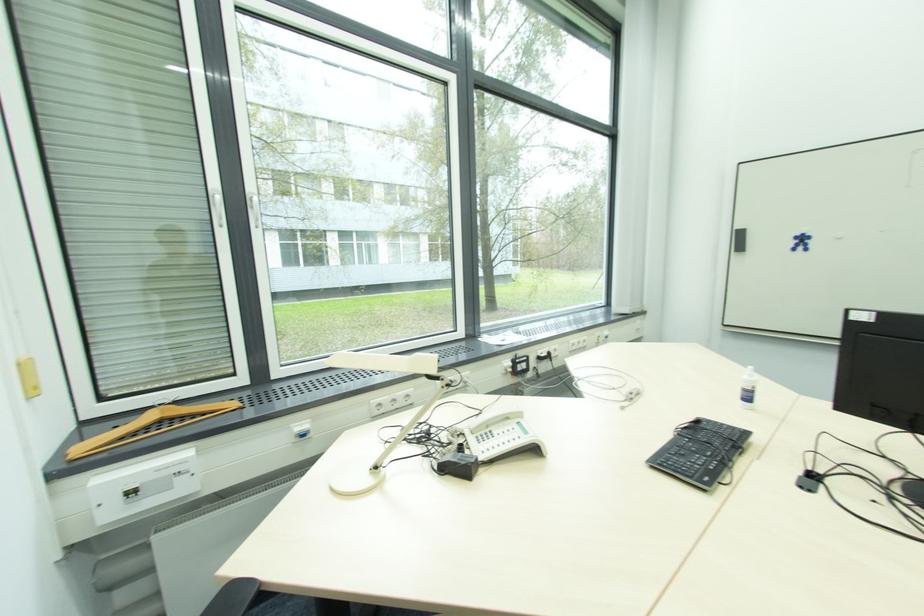
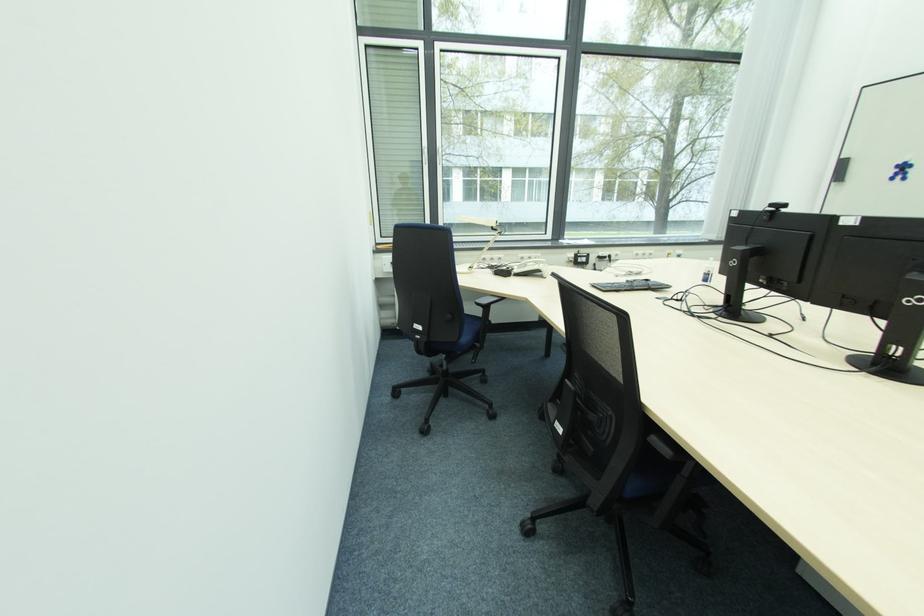
Find the pixel in the second image that matches pixel 467 430 in the first image.

(519, 270)